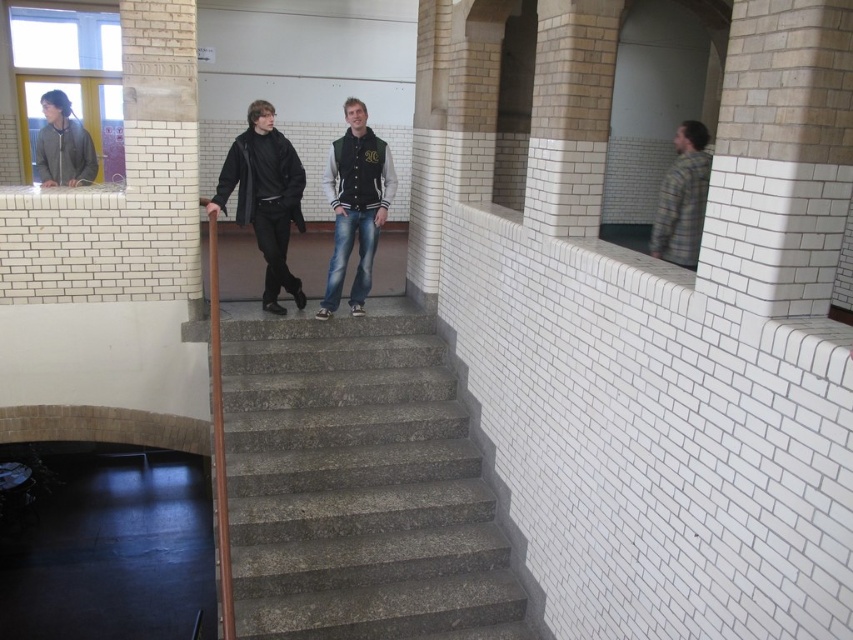
Can you confirm if gray concrete stairs at center is positioned above varsity jacket at center?

No, gray concrete stairs at center is not above varsity jacket at center.

Is gray concrete stairs at center smaller than varsity jacket at center?

No.

Does point (465, 577) come farther from viewer compared to point (346, 188)?

No, it is in front of (346, 188).

I want to click on gray concrete stairs at center, so click(357, 484).

Is point (281, 253) more distant than point (341, 160)?

That is False.

Is black matte jacket at center to the left of varsity jacket at center from the viewer's perspective?

Yes, black matte jacket at center is to the left of varsity jacket at center.

Describe the element at coordinates (265, 196) in the screenshot. I see `black matte jacket at center` at that location.

Identify the location of black matte jacket at center. The image size is (853, 640). (265, 196).

Is gray concrete stairs at center taller than matte gray jacket at upper left?

Yes, gray concrete stairs at center is taller than matte gray jacket at upper left.

Is gray concrete stairs at center to the right of matte gray jacket at upper left from the viewer's perspective?

Correct, you'll find gray concrete stairs at center to the right of matte gray jacket at upper left.

Which is behind, point (264, 360) or point (62, 102)?

Positioned behind is point (62, 102).

Where is `gray concrete stairs at center`? gray concrete stairs at center is located at coordinates (357, 484).